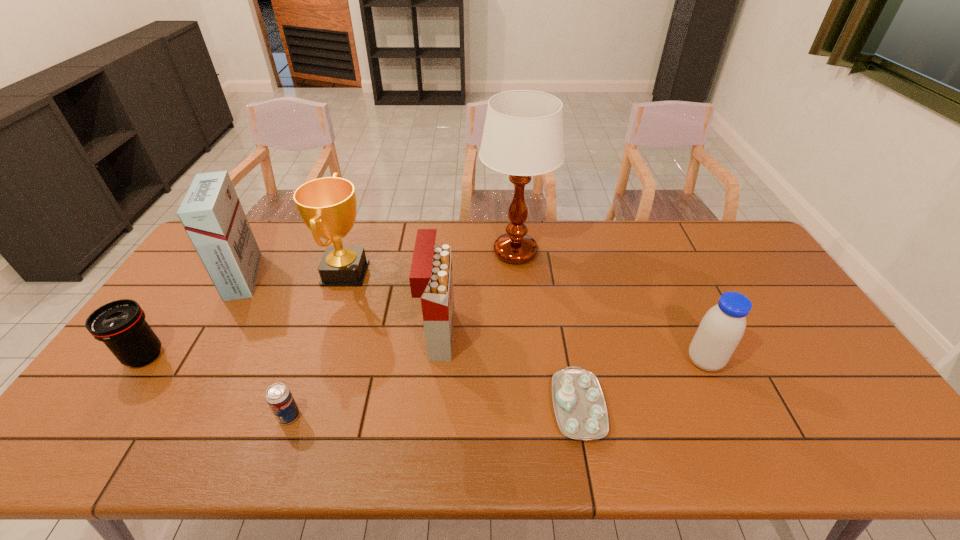
In the image, there is a desktop. At what (x,y) coordinates should I click in order to perform the action: click on vacant space at the right edge. Please return your answer as a coordinate pair (x, y). This screenshot has height=540, width=960. Looking at the image, I should click on (813, 413).

Locate an element on the screen. Image resolution: width=960 pixels, height=540 pixels. vacant area at the near right corner of the desktop is located at coordinates (877, 426).

Identify the location of vacant area between the beer can and the third shortest object. point(217,386).

Locate an element on the screen. free space between the seventh tallest object and the fourth shortest object is located at coordinates (496, 389).

Where is `free space between the third shortest object and the seventh tallest object`? The height and width of the screenshot is (540, 960). free space between the third shortest object and the seventh tallest object is located at coordinates (217, 386).

Identify the location of vacant area that lies between the award and the beer can. [317, 344].

Identify the location of vacant space that is in between the telephoto lens and the shortest object. This screenshot has height=540, width=960. (361, 381).

Identify the location of vacant region between the award and the fifth tallest object. pyautogui.click(x=525, y=317).

This screenshot has width=960, height=540. In order to click on vacant area that lies between the beer can and the farther cigarette case in this screenshot , I will do pyautogui.click(x=266, y=346).

You are a GUI agent. You are given a task and a screenshot of the screen. Output one action in this format:
    pyautogui.click(x=<x>, y=<y>)
    Task: Click on the vacant region between the nearer cigarette case and the tallest object
    
    Given the screenshot: What is the action you would take?
    pyautogui.click(x=477, y=293)